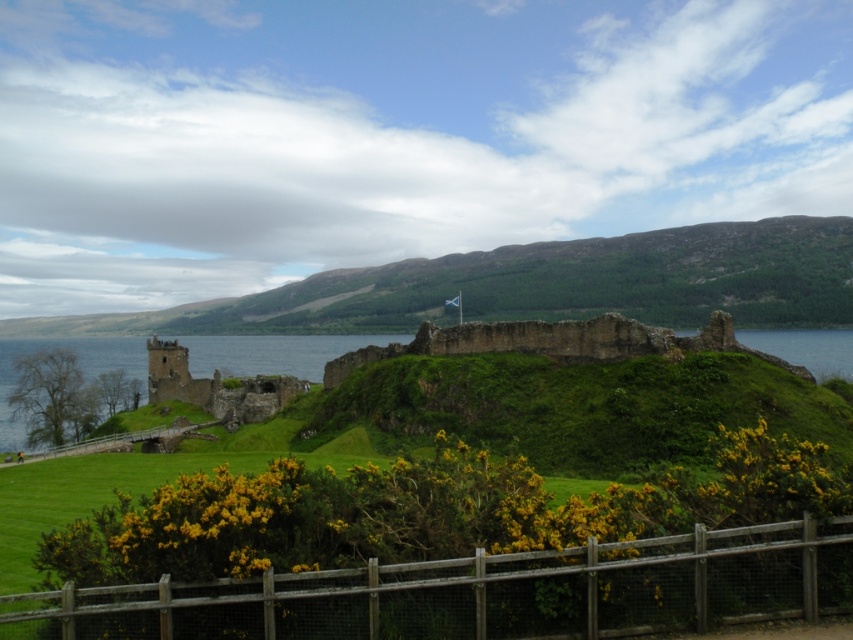
You are standing at the wooden fence at the bottom of the image. Looking towards the center, you see the green grassy hillside at center and the brown stone ruins at center. Which object is higher up in the image?

The green grassy hillside at center is above the brown stone ruins at center, so it is higher up in the image.

You are standing at the wooden fence in the scene. Which direction should you walk to reach the green grassy hillside at center?

The green grassy hillside at center is located at coordinates point (543, 285). Since you are at the wooden fence at the bottom of the frame, you should walk towards the center of the image to reach it.